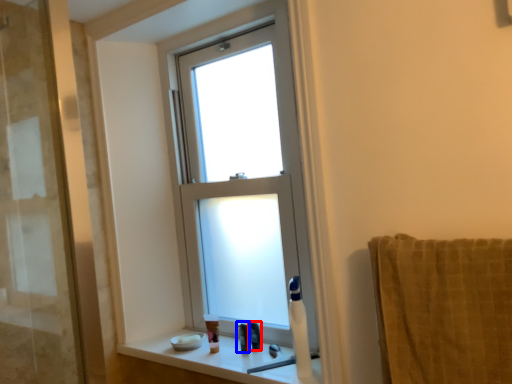
Question: Which object is closer to the camera taking this photo, toiletry (highlighted by a red box) or toiletry (highlighted by a blue box)?

Choices:
 (A) toiletry
 (B) toiletry

Answer: (B)